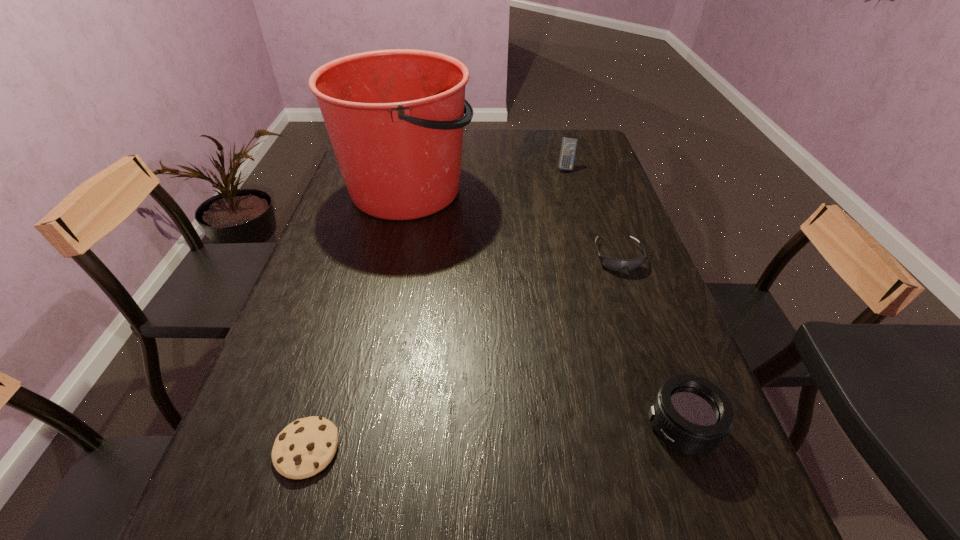
This screenshot has width=960, height=540. Identify the location of free space between the third farthest object and the second tallest object. (591, 212).

The width and height of the screenshot is (960, 540). Identify the location of vacant space in between the cookie and the goggles. (463, 353).

At what (x,y) coordinates should I click in order to perform the action: click on vacant space that's between the bucket and the third tallest object. Please return your answer as a coordinate pair (x, y). Looking at the image, I should click on (544, 308).

Point out which object is positioned as the nearest to the third shortest object. Please provide its 2D coordinates. Your answer should be formatted as a tuple, i.e. [(x, y)], where the tuple contains the x and y coordinates of a point satisfying the conditions above.

[(614, 264)]

Where is `object identified as the third closest to the tallest object`? The image size is (960, 540). object identified as the third closest to the tallest object is located at coordinates (305, 447).